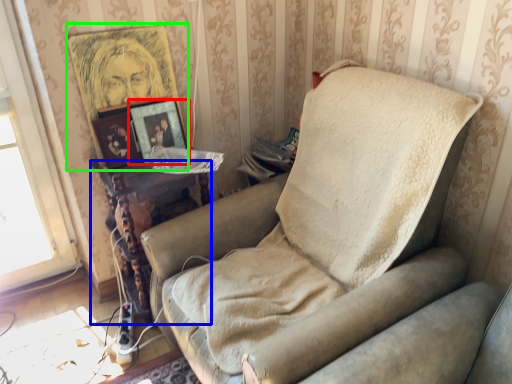
Question: Based on their relative distances, which object is farther from picture frame (highlighted by a red box)? Choose from table (highlighted by a blue box) and picture frame (highlighted by a green box).

Choices:
 (A) table
 (B) picture frame

Answer: (A)